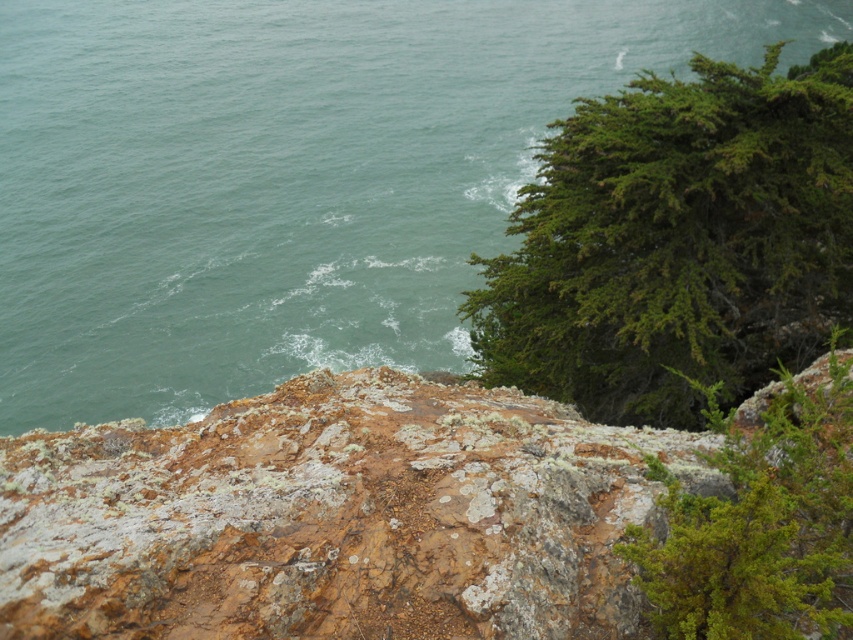
You are a hiker standing at the rocky outcrop in the foreground of the coastal landscape. You notice a point marked at coordinates [288,179]. What is the location of this point relative to the rocky outcrop and the ocean?

The point marked at [288,179] is located at the green water at upper left, which is in the middle ground near the shoreline where small waves are breaking.